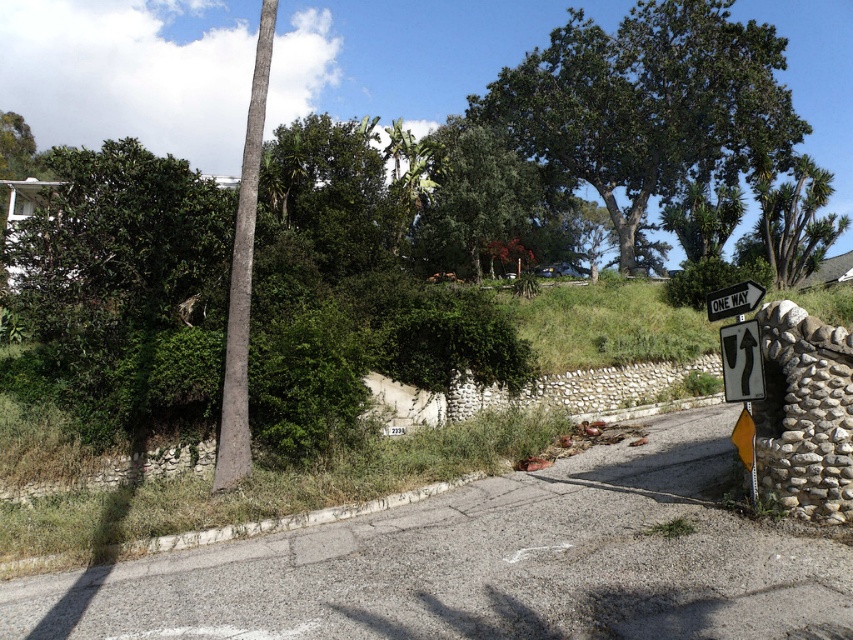
You are a city planner reviewing the street layout. You need to determine if the rustic stone wall at right can be replaced with a wider version without affecting the placement of the metallic reflective one way sign at right. Can the sign stay in its current position if the wall is made wider?

The rustic stone wall at right is currently narrower than the metallic reflective one way sign at right. If the wall is made wider, it might interfere with the sign since the sign is already positioned on the wall. The sign may need to be repositioned to accommodate the wider wall.

You are driving a delivery truck and need to pass under the green leafy tree at upper center and the smooth gray pole at upper left. Can your truck clear the height of both objects?

The smooth gray pole at upper left is behind green leafy tree at upper center, so the truck must first pass under the green leafy tree at upper center. However, the height of the objects isn not specified in the description, so it is impossible to determine if the truck can clear them.

You are a delivery driver who needs to park your van on the street. The van is 7 meters long. There is a green leafy tree at upper center. Is there enough space between the tree and the stone wall to park your van?

The distance between the green leafy tree at upper center and the stone wall is 29.73 meters, which is more than enough to park a 7 meter long van.